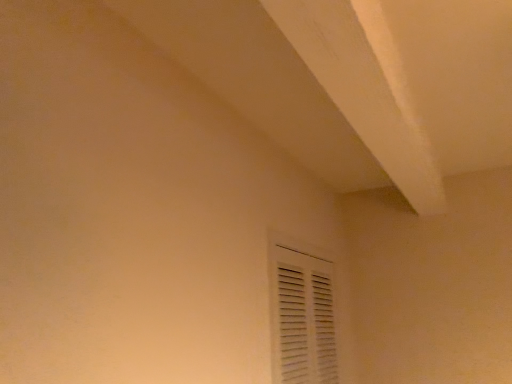
Find the location of a particular element. white matte vent at lower right is located at coordinates (303, 315).

What do you see at coordinates (303, 315) in the screenshot?
I see `white matte vent at lower right` at bounding box center [303, 315].

I want to click on white matte vent at lower right, so click(303, 315).